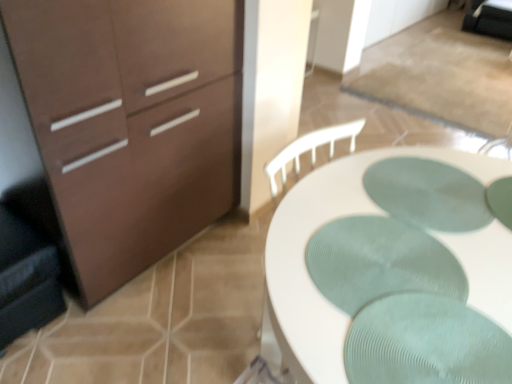
Where is `vacant space behind green ribbed placemat at center, which is the 2th oval in back-to-front order`? The image size is (512, 384). vacant space behind green ribbed placemat at center, which is the 2th oval in back-to-front order is located at coordinates (376, 193).